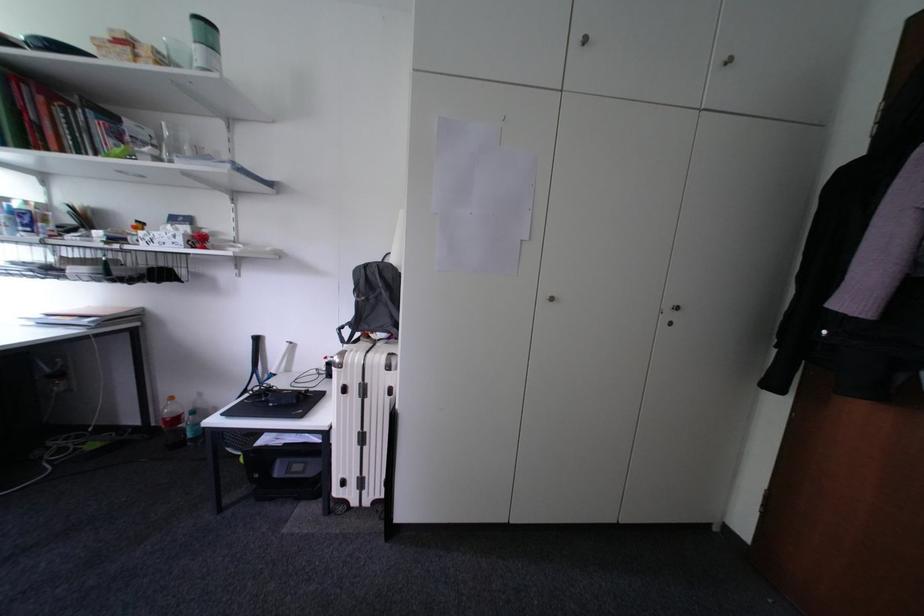
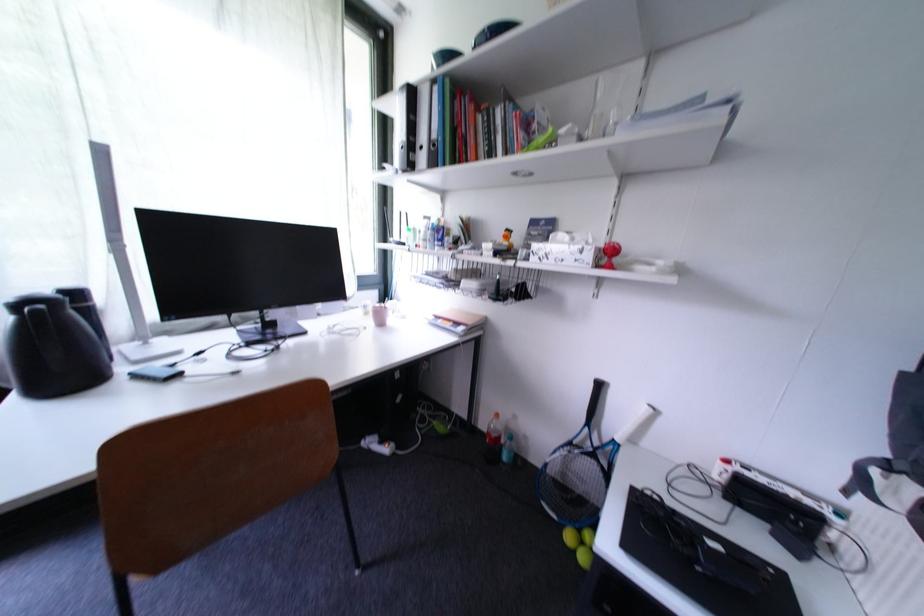
In the second image, find the point that corresponds to [181,238] in the first image.

(590, 253)